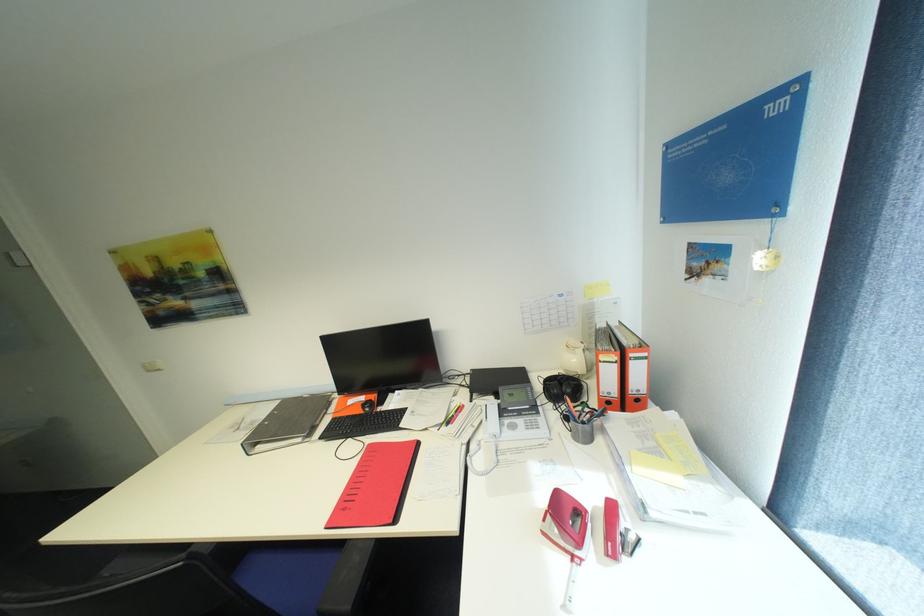
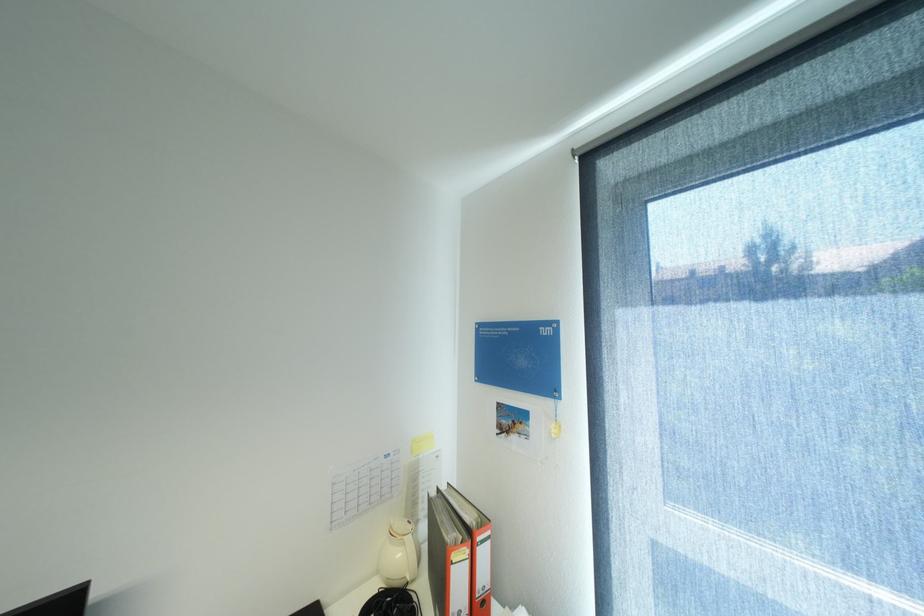
The point at (638, 392) is marked in the first image. Where is the corresponding point in the second image?

(484, 597)